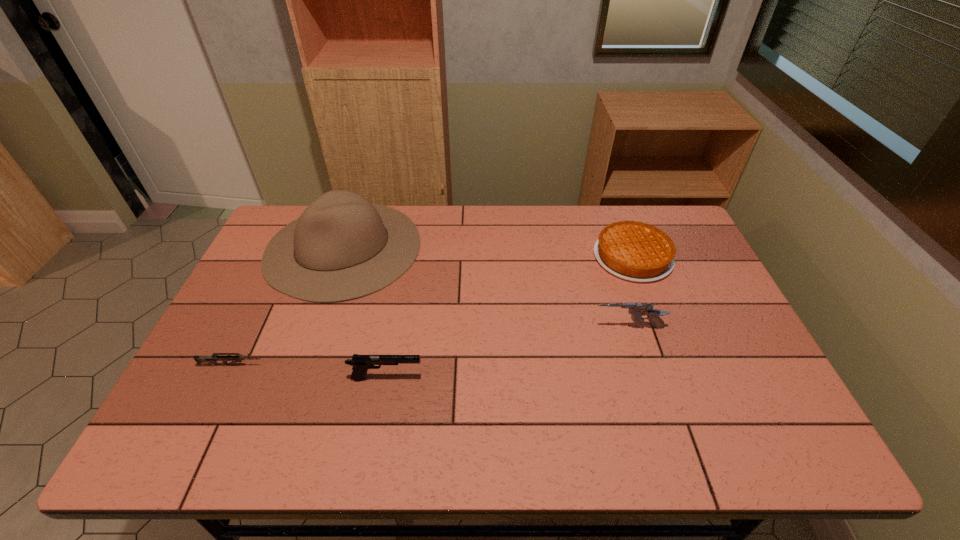
The height and width of the screenshot is (540, 960). What are the coordinates of `free space located at the barrel of the third farthest object` in the screenshot? It's located at (545, 328).

Identify the location of free location located at the barrel of the third farthest object. tap(509, 328).

The image size is (960, 540). I want to click on vacant space located 0.200m at the aiming end of the nearest gun, so click(x=503, y=378).

In order to click on vacant position located 0.330m on the left of the pie in this screenshot , I will do `click(492, 257)`.

Where is `vacant space located 0.210m aimed along the barrel of the leftmost gun`? vacant space located 0.210m aimed along the barrel of the leftmost gun is located at coordinates (347, 365).

Where is `sombrero that is at the far edge`? Image resolution: width=960 pixels, height=540 pixels. sombrero that is at the far edge is located at coordinates (347, 248).

The height and width of the screenshot is (540, 960). Identify the location of pie present at the far edge. (634, 251).

You are a GUI agent. You are given a task and a screenshot of the screen. Output one action in this format:
    pyautogui.click(x=<x>, y=<y>)
    Task: Click on the sombrero that is at the left edge
    The width and height of the screenshot is (960, 540).
    Given the screenshot: What is the action you would take?
    pyautogui.click(x=347, y=248)

In order to click on gun that is at the left edge in this screenshot , I will do `click(213, 359)`.

At what (x,y) coordinates should I click in order to perform the action: click on object that is positioned at the right edge. Please return your answer as a coordinate pair (x, y). The width and height of the screenshot is (960, 540). Looking at the image, I should click on (634, 251).